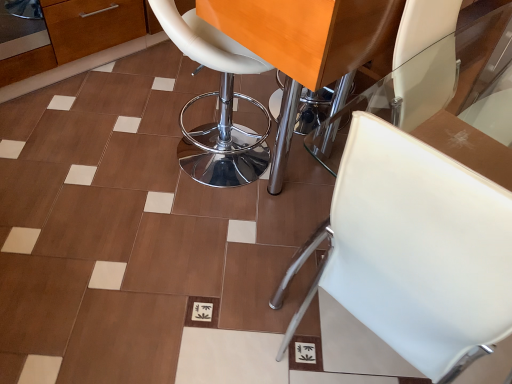
Question: Which direction should I rotate to face white leather stool at center, the second chair positioned from the right, — up or down?

Choices:
 (A) down
 (B) up

Answer: (B)

Question: Is white leather chair at center, positioned as the 2th chair in left-to-right order, in front of white leather stool at center, the 1th chair positioned from the left?

Choices:
 (A) yes
 (B) no

Answer: (A)

Question: From the image's perspective, is white leather chair at center, positioned as the 2th chair in left-to-right order, below white leather stool at center, the 1th chair positioned from the left?

Choices:
 (A) yes
 (B) no

Answer: (A)

Question: Does white leather chair at center, the 1th chair positioned from the right, contain white leather stool at center, the second chair positioned from the right?

Choices:
 (A) yes
 (B) no

Answer: (B)

Question: From the image's perspective, is white leather chair at center, the 1th chair positioned from the right, on white leather stool at center, the 1th chair positioned from the left?

Choices:
 (A) yes
 (B) no

Answer: (B)

Question: Is white leather chair at center, the 1th chair positioned from the right, behind white leather stool at center, the second chair positioned from the right?

Choices:
 (A) no
 (B) yes

Answer: (A)

Question: Does white leather chair at center, positioned as the 2th chair in left-to-right order, turn towards white leather stool at center, the 1th chair positioned from the left?

Choices:
 (A) yes
 (B) no

Answer: (B)

Question: Considering the relative positions of white leather stool at center, the second chair positioned from the right, and white leather chair at center, positioned as the 2th chair in left-to-right order, in the image provided, is white leather stool at center, the second chair positioned from the right, to the left of white leather chair at center, positioned as the 2th chair in left-to-right order, from the viewer's perspective?

Choices:
 (A) no
 (B) yes

Answer: (B)

Question: From a real-world perspective, is white leather stool at center, the second chair positioned from the right, positioned under white leather chair at center, the 1th chair positioned from the right, based on gravity?

Choices:
 (A) no
 (B) yes

Answer: (A)

Question: Considering the relative sizes of white leather stool at center, the second chair positioned from the right, and white leather chair at center, the 1th chair positioned from the right, in the image provided, is white leather stool at center, the second chair positioned from the right, wider than white leather chair at center, the 1th chair positioned from the right,?

Choices:
 (A) yes
 (B) no

Answer: (B)

Question: Does white leather stool at center, the 1th chair positioned from the left, have a larger size compared to white leather chair at center, positioned as the 2th chair in left-to-right order?

Choices:
 (A) yes
 (B) no

Answer: (B)

Question: Does white leather stool at center, the second chair positioned from the right, have a lesser width compared to white leather chair at center, the 1th chair positioned from the right?

Choices:
 (A) yes
 (B) no

Answer: (A)

Question: Is white leather stool at center, the second chair positioned from the right, turned away from white leather chair at center, positioned as the 2th chair in left-to-right order?

Choices:
 (A) no
 (B) yes

Answer: (A)

Question: Is white leather stool at center, the 1th chair positioned from the left, taller or shorter than white leather chair at center, the 1th chair positioned from the right?

Choices:
 (A) short
 (B) tall

Answer: (B)